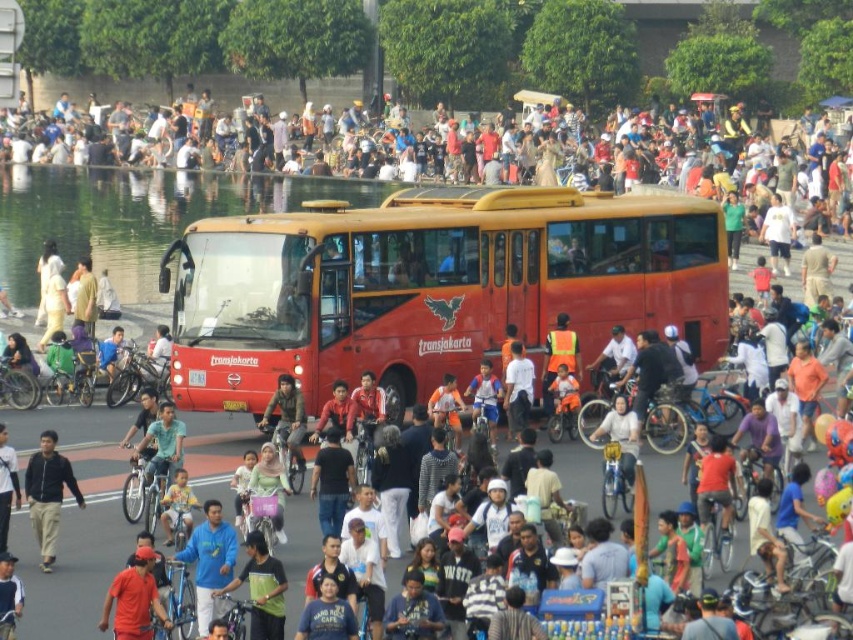
Question: Is matte black jacket at center wider than jeans at center?

Choices:
 (A) no
 (B) yes

Answer: (B)

Question: Considering the relative positions of matte red bus at center and orange fabric shirt at lower left in the image provided, where is matte red bus at center located with respect to orange fabric shirt at lower left?

Choices:
 (A) below
 (B) above

Answer: (B)

Question: Based on their relative distances, which object is farther from the matte red bus at center?

Choices:
 (A) jeans at center
 (B) orange fabric shirt at lower left
 (C) matte black jacket at center
 (D) dark blue shirt at center

Answer: (B)

Question: Which point is farther to the camera?

Choices:
 (A) jeans at center
 (B) matte red bus at center
 (C) orange fabric shirt at lower left

Answer: (B)

Question: Is matte black jacket at center closer to the viewer compared to dark blue shirt at center?

Choices:
 (A) yes
 (B) no

Answer: (B)

Question: Considering the real-world distances, which object is closest to the jeans at center?

Choices:
 (A) matte red bus at center
 (B) matte black jacket at center
 (C) dark blue shirt at center

Answer: (A)